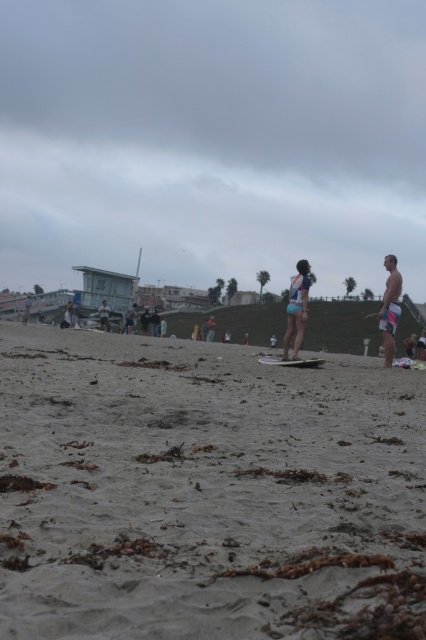
You are a photographer on the beach and want to capture both the matte blue swimsuit at center and the smooth tan surfboard at center in the same frame. Which object should you focus on first to ensure both are in focus?

The matte blue swimsuit at center is located below the smooth tan surfboard at center. To ensure both are in focus, you should focus on the smooth tan surfboard at center first since it is higher in the frame, allowing the depth of field to cover the lower positioned matte blue swimsuit at center.

You are a photographer trying to capture both the matte blue swimsuit at center and the smooth tan surfboard at center in a single frame. Which object will appear larger in the photo?

The smooth tan surfboard at center will appear larger in the photo because it is bigger than the matte blue swimsuit at center.